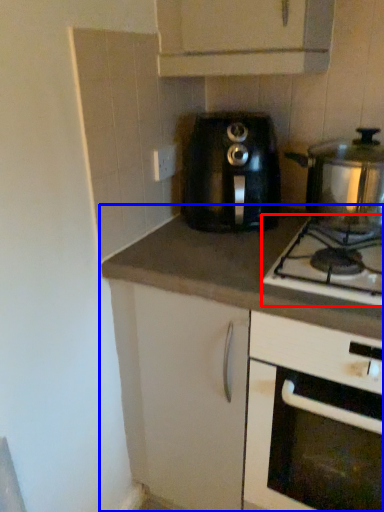
Question: Which of the following is the closest to the observer, gas stove (highlighted by a red box) or countertop (highlighted by a blue box)?

Choices:
 (A) gas stove
 (B) countertop

Answer: (A)